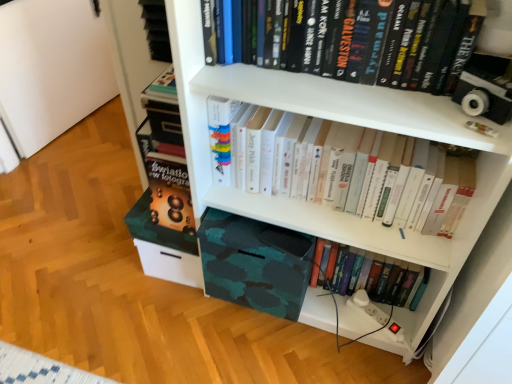
Question: Is point (409, 269) positioned closer to the camera than point (245, 110)?

Choices:
 (A) farther
 (B) closer

Answer: (A)

Question: Would you say hardcover book at lower center, the 3th book when ordered from top to bottom, is to the left or to the right of white paper book at center, the second book in the top-to-bottom sequence, in the picture?

Choices:
 (A) right
 (B) left

Answer: (A)

Question: Based on their relative distances, which object is nearer to the hardcover books at upper center, arranged as the third book when ordered from the bottom?

Choices:
 (A) hardcover book at lower center, which is counted as the first book, starting from the bottom
 (B) white paper book at center, the second book ordered from the bottom
 (C) camo fabric box at lower center

Answer: (B)

Question: Which is nearer to the hardcover books at upper center, which appears as the 1th book when viewed from the top?

Choices:
 (A) camo fabric box at lower center
 (B) hardcover book at lower center, which is counted as the first book, starting from the bottom
 (C) white paper book at center, the second book in the top-to-bottom sequence

Answer: (C)